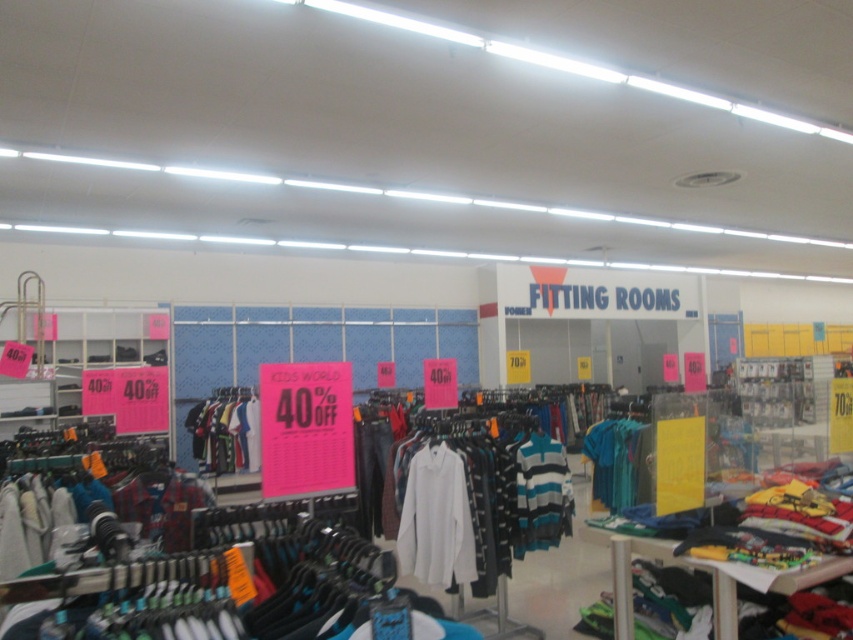
Is striped cotton shirt at center smaller than teal fabric shirt at center?

No.

Is point (222, 438) positioned in front of point (589, 452)?

No, it is not.

Where is `striped cotton shirt at center`? The image size is (853, 640). striped cotton shirt at center is located at coordinates (225, 429).

Is white cotton shirt at center to the right of striped cotton sweater at center from the viewer's perspective?

No, white cotton shirt at center is not to the right of striped cotton sweater at center.

Based on the photo, who is lower down, white cotton shirt at center or striped cotton sweater at center?

white cotton shirt at center is below.

The width and height of the screenshot is (853, 640). Describe the element at coordinates (436, 518) in the screenshot. I see `white cotton shirt at center` at that location.

Image resolution: width=853 pixels, height=640 pixels. In order to click on white cotton shirt at center in this screenshot , I will do `click(436, 518)`.

Can you confirm if white cotton shirt at center is wider than teal fabric shirt at center?

Yes, white cotton shirt at center is wider than teal fabric shirt at center.

Image resolution: width=853 pixels, height=640 pixels. I want to click on white cotton shirt at center, so click(436, 518).

Find the location of `white cotton shirt at center`. white cotton shirt at center is located at coordinates (436, 518).